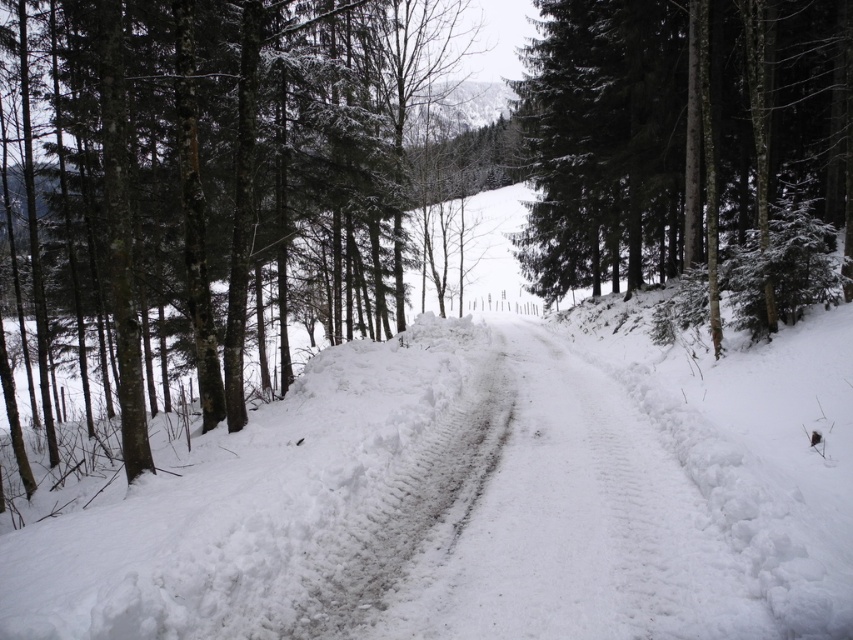
Question: Is dark green textured tree at left bigger than green textured tree at center?

Choices:
 (A) yes
 (B) no

Answer: (A)

Question: Observing the image, what is the correct spatial positioning of white fluffy snow at center in reference to dark green textured tree at left?

Choices:
 (A) above
 (B) below

Answer: (B)

Question: Which point appears farthest from the camera in this image?

Choices:
 (A) (473, 612)
 (B) (546, 81)
 (C) (97, 340)

Answer: (C)

Question: Is the position of white fluffy snow at center more distant than that of white snow-covered dirt track at center?

Choices:
 (A) yes
 (B) no

Answer: (B)

Question: Which object is the closest to the dark green textured tree at left?

Choices:
 (A) green textured tree at center
 (B) white snow-covered dirt track at center
 (C) white fluffy snow at center

Answer: (C)

Question: Estimate the real-world distances between objects in this image. Which object is closer to the white snow-covered dirt track at center?

Choices:
 (A) green textured tree at center
 (B) white fluffy snow at center

Answer: (B)